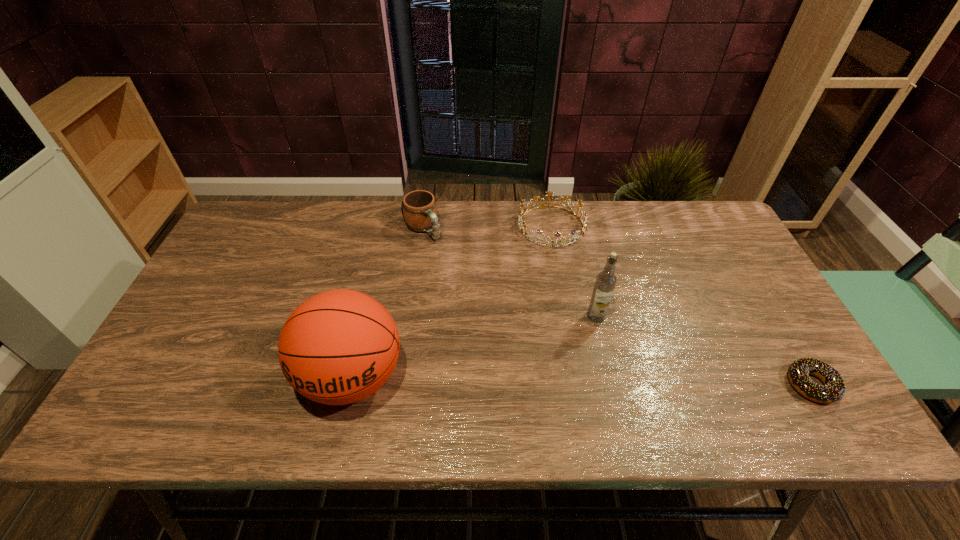
You are a GUI agent. You are given a task and a screenshot of the screen. Output one action in this format:
    pyautogui.click(x=<x>, y=<y>)
    Task: Click on the vacant space on the desktop that is between the basketball and the doughnut and is positioned on the label of the third farthest object
    This screenshot has width=960, height=540.
    Given the screenshot: What is the action you would take?
    pyautogui.click(x=524, y=380)

The height and width of the screenshot is (540, 960). In order to click on free space on the desktop that is between the basketball and the rightmost object and is positioned on the side of the third shortest object with the handle in this screenshot , I will do `click(552, 380)`.

I want to click on vacant space on the desktop that is between the basketball and the rightmost object and is positioned on the front-facing side of the tiara, so click(x=577, y=381).